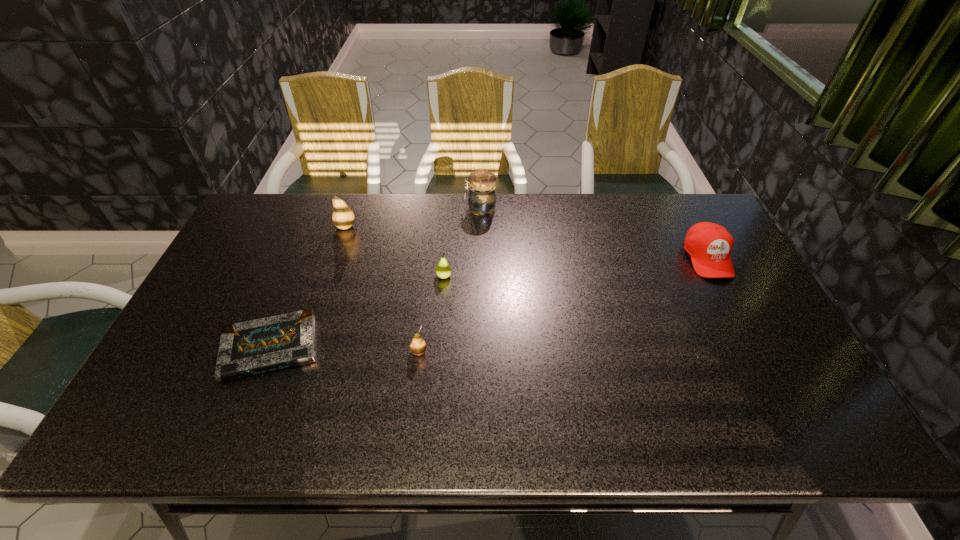
Locate an element on the screen. The width and height of the screenshot is (960, 540). vacant space located on the lid of the jar is located at coordinates (371, 209).

The height and width of the screenshot is (540, 960). I want to click on free spot located 0.210m on the lid of the jar, so click(405, 209).

In order to click on vacant area located 0.080m on the lid of the jar in this screenshot , I will do `click(442, 209)`.

Image resolution: width=960 pixels, height=540 pixels. Identify the location of free space located on the back of the farthest pear. (353, 203).

The width and height of the screenshot is (960, 540). What are the coordinates of `blank space located on the front panel of the baseball cap` in the screenshot? It's located at (763, 366).

The width and height of the screenshot is (960, 540). In order to click on free space located 0.380m on the front of the second farthest pear in this screenshot , I will do `click(434, 399)`.

I want to click on vacant region located 0.060m on the front of the nearest pear, so point(416,380).

Locate an element on the screen. Image resolution: width=960 pixels, height=540 pixels. vacant space located 0.110m on the back of the shortest object is located at coordinates (295, 287).

I want to click on jar situated at the far edge, so click(481, 196).

Locate an element on the screen. pear that is positioned at the far edge is located at coordinates (343, 217).